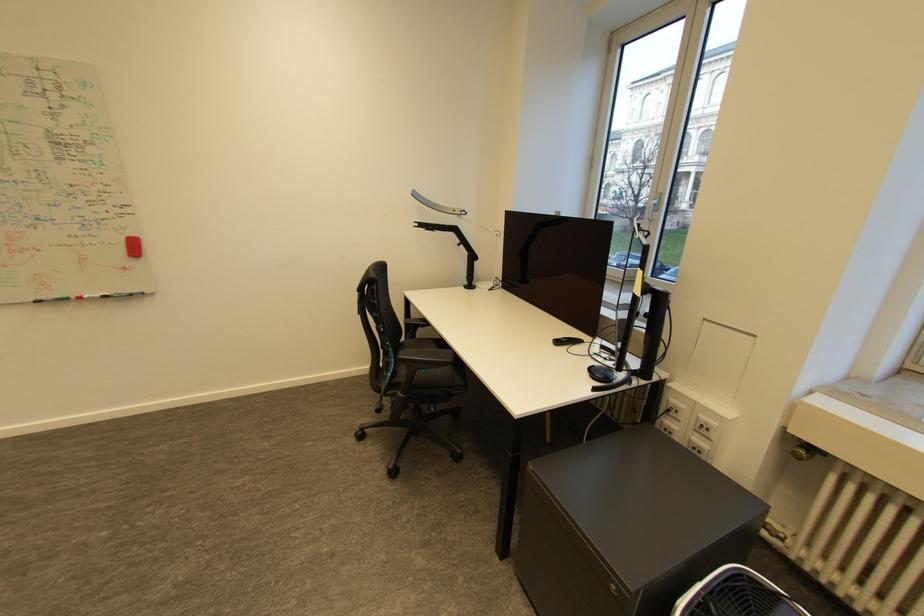
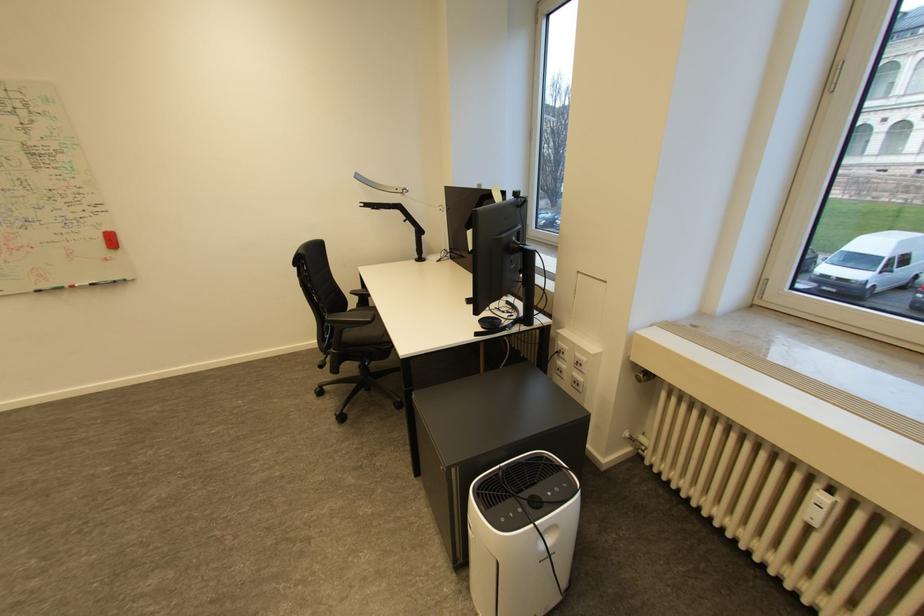
In the second image, find the point that corresponds to the point at 49,299 in the first image.

(47, 288)